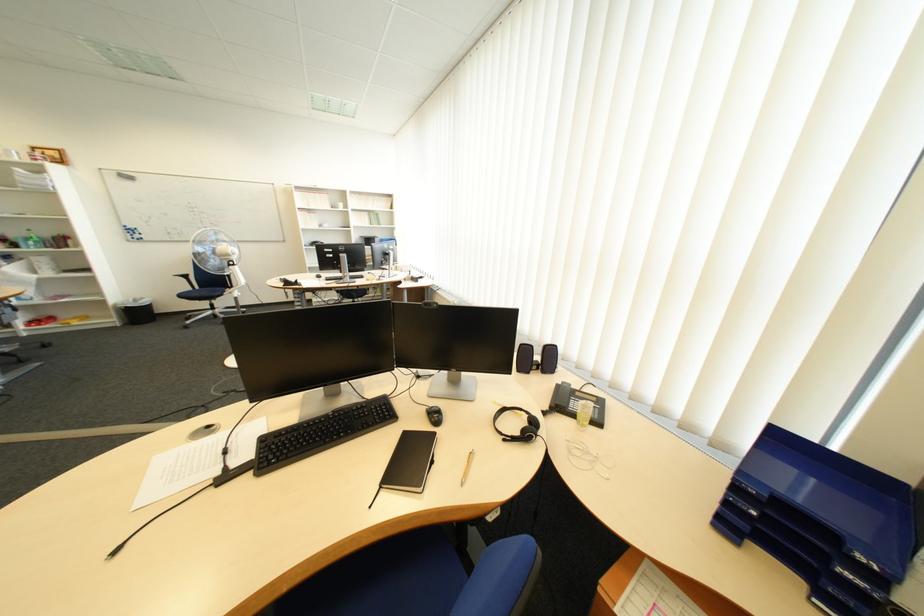
I want to click on blue paper tray, so click(823, 561).